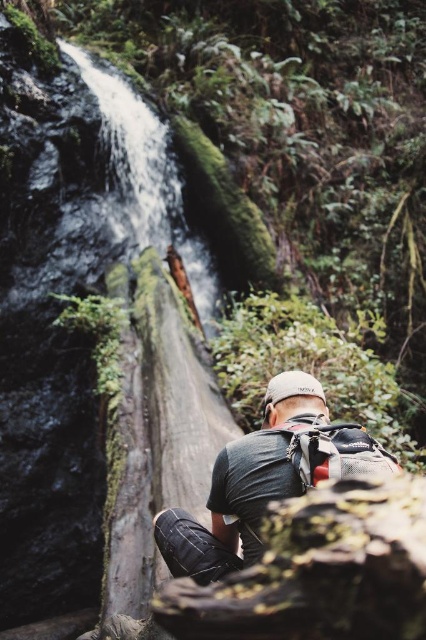
Who is positioned more to the left, green mossy tree trunk at center or dark gray fabric backpack at center?

From the viewer's perspective, green mossy tree trunk at center appears more on the left side.

Who is shorter, green mossy tree trunk at center or dark gray fabric backpack at center?

With less height is dark gray fabric backpack at center.

Is point (118, 419) farther from viewer compared to point (221, 464)?

Yes, it is.

Identify the location of green mossy tree trunk at center. This screenshot has width=426, height=640. (155, 449).